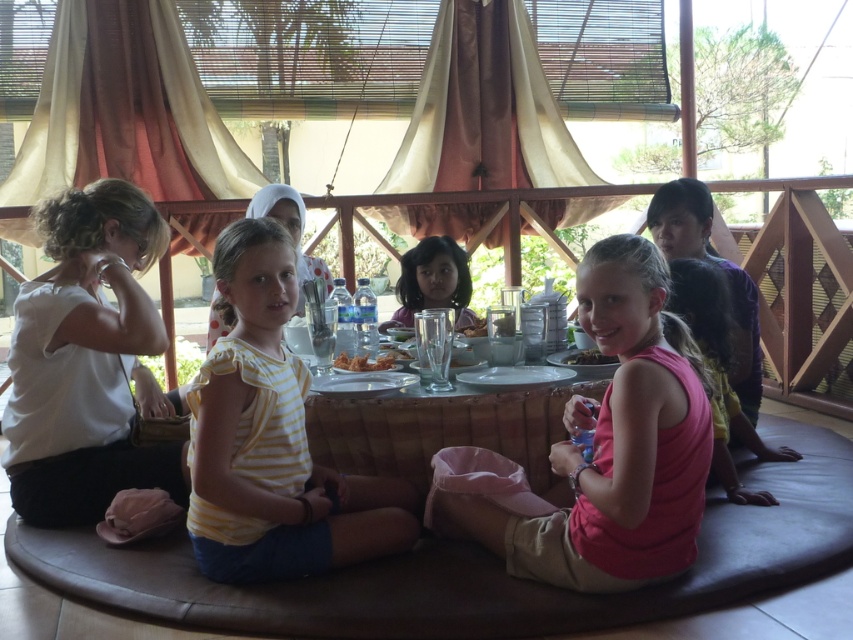
Question: Which point appears farthest from the camera in this image?

Choices:
 (A) (474, 326)
 (B) (236, 340)

Answer: (A)

Question: Can you confirm if pink fabric at center is thinner than golden crispy fried chicken at center?

Choices:
 (A) no
 (B) yes

Answer: (A)

Question: Can you confirm if pink fabric at center is positioned to the right of dark brown glossy plate at center?

Choices:
 (A) no
 (B) yes

Answer: (A)

Question: Considering the real-world distances, which object is closest to the white matte shirt at left?

Choices:
 (A) yellow striped shirt at center
 (B) pink fabric dress at center
 (C) dark brown glossy plate at center
 (D) golden crispy fried chicken at center

Answer: (A)

Question: Can you confirm if pink fabric at center is bigger than pink fabric dress at center?

Choices:
 (A) yes
 (B) no

Answer: (A)

Question: Considering the real-world distances, which object is closest to the yellow striped shirt at center?

Choices:
 (A) translucent glass cup at center
 (B) pink fabric dress at center

Answer: (A)